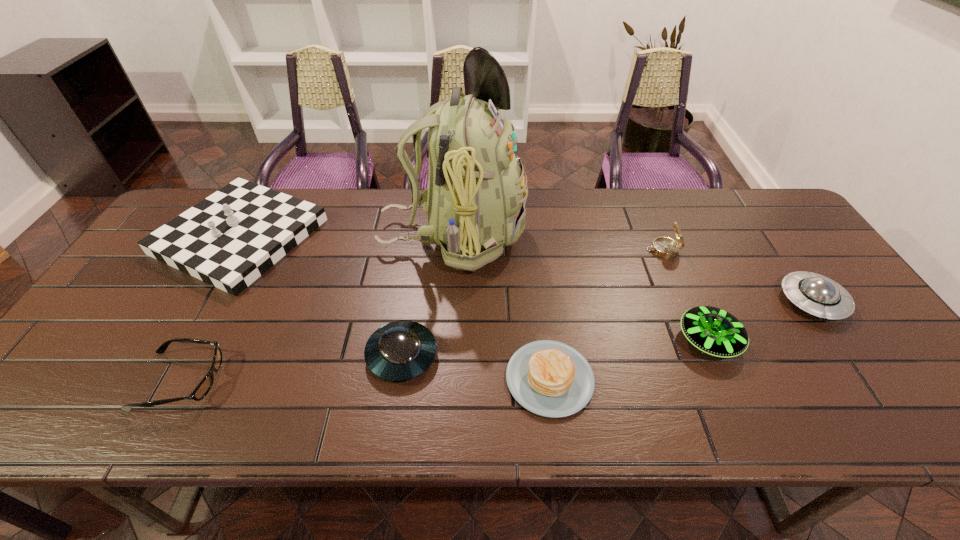
I want to click on pancake situated at the near edge, so click(548, 378).

The image size is (960, 540). I want to click on spectacles present at the near edge, so click(203, 388).

Find the location of `object located at the left edge`. object located at the left edge is located at coordinates (228, 240).

This screenshot has height=540, width=960. What are the coordinates of `object that is at the right edge` in the screenshot? It's located at (815, 294).

Where is `object that is at the far left corner`? object that is at the far left corner is located at coordinates (228, 240).

This screenshot has width=960, height=540. Find the location of `vacant region at the far edge of the desktop`. vacant region at the far edge of the desktop is located at coordinates (372, 221).

The image size is (960, 540). Identify the location of vacant space at the near edge of the desktop. (157, 395).

This screenshot has height=540, width=960. I want to click on vacant space at the left edge, so click(x=116, y=382).

Find the location of a particular element. The height and width of the screenshot is (540, 960). vacant area at the right edge is located at coordinates (818, 264).

In the image, there is a desktop. Where is `free space at the far right corner`? Image resolution: width=960 pixels, height=540 pixels. free space at the far right corner is located at coordinates (728, 207).